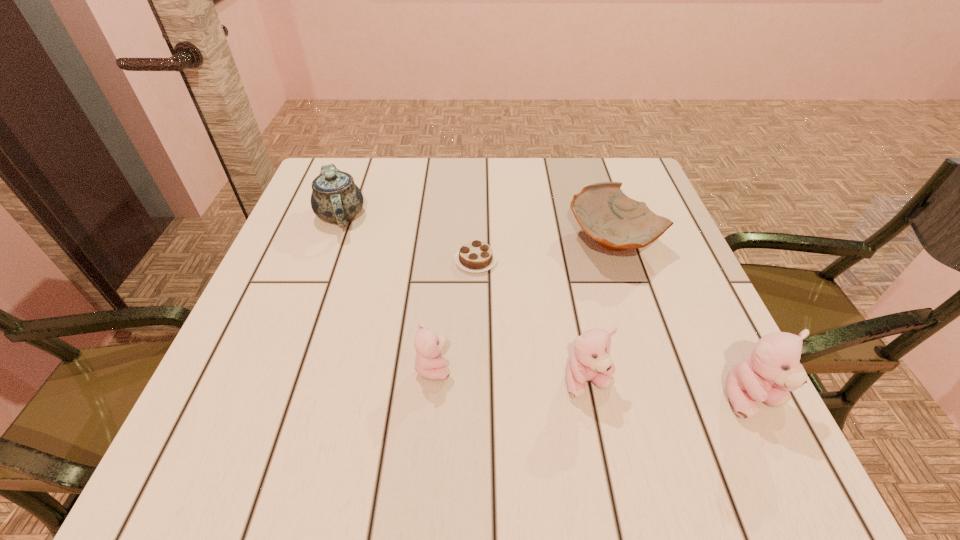
In the current image, all teddy bears are evenly spaced. To maintain this equal spacing, where should an additional teddy bear be placed on the left? Please point out a free spot. Please provide its 2D coordinates. Your answer should be formatted as a tuple, i.e. [(x, y)], where the tuple contains the x and y coordinates of a point satisfying the conditions above.

[(286, 353)]